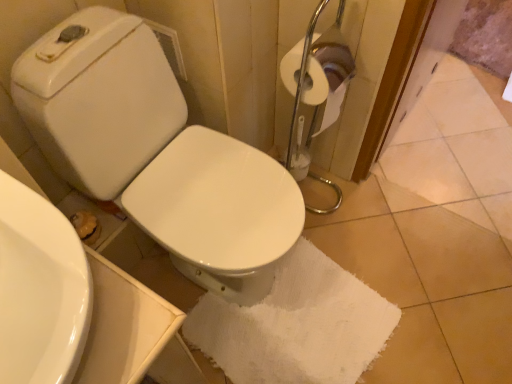
The height and width of the screenshot is (384, 512). What are the coordinates of `vacant area that lies to the right of white cotton bath towel at center` in the screenshot? It's located at (426, 292).